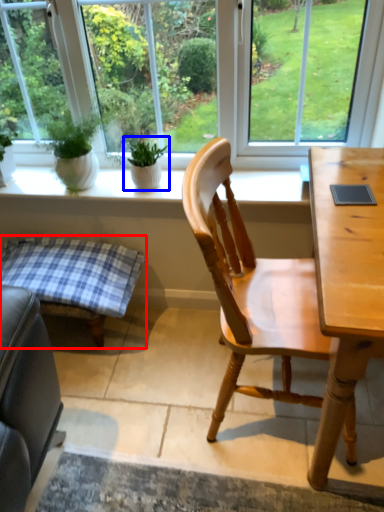
Question: Which point is further to the camera, table (highlighted by a red box) or houseplant (highlighted by a blue box)?

Choices:
 (A) table
 (B) houseplant

Answer: (B)